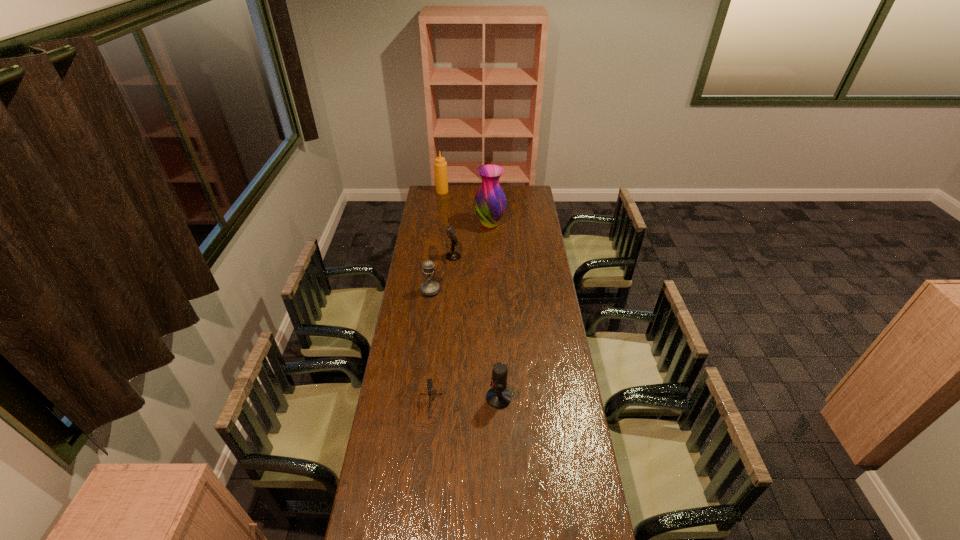
The width and height of the screenshot is (960, 540). What are the coordinates of `vacant region at the right edge of the desktop` in the screenshot? It's located at (570, 481).

The image size is (960, 540). Identify the location of vacant space at the far left corner of the desktop. (446, 193).

Find the location of a particular element. The image size is (960, 540). free space at the far right corner of the desktop is located at coordinates (531, 193).

Image resolution: width=960 pixels, height=540 pixels. What are the coordinates of `blank region between the rightmost microphone and the farthest microphone` in the screenshot? It's located at point(475,328).

At what (x,y) coordinates should I click in order to perform the action: click on empty location between the rightmost microphone and the third nearest object. Please return your answer as a coordinate pair (x, y). The width and height of the screenshot is (960, 540). Looking at the image, I should click on (465, 344).

I want to click on empty space that is in between the rightmost microphone and the shortest microphone, so click(464, 403).

Identify the location of free spot between the rightmost microphone and the third farthest object. [475, 328].

At what (x,y) coordinates should I click in order to perform the action: click on empty location between the fourth nearest object and the fifth nearest object. Please return your answer as a coordinate pair (x, y). The image size is (960, 540). Looking at the image, I should click on (470, 241).

Where is `free space between the farthest object and the second farthest microphone`? The width and height of the screenshot is (960, 540). free space between the farthest object and the second farthest microphone is located at coordinates (436, 241).

You are a GUI agent. You are given a task and a screenshot of the screen. Output one action in this format:
    pyautogui.click(x=<x>, y=<y>)
    Task: Click on the vacant point located between the shortest object and the rightmost microphone
    Image resolution: width=960 pixels, height=540 pixels.
    Given the screenshot: What is the action you would take?
    pyautogui.click(x=464, y=403)